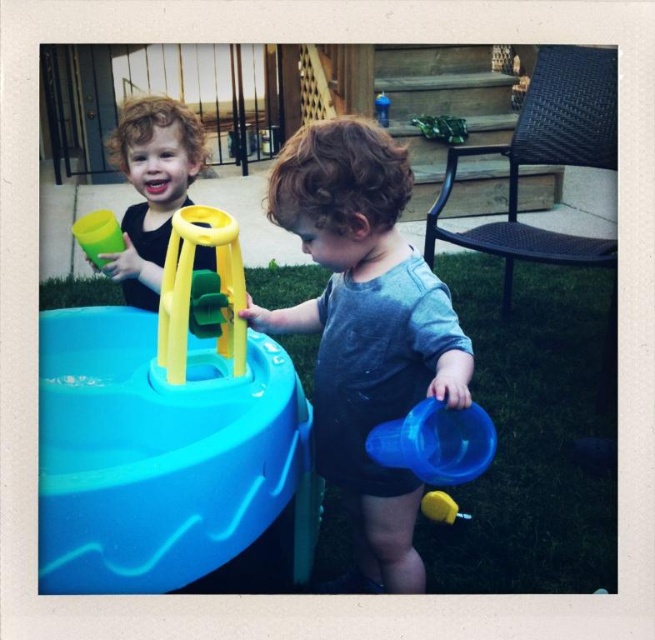
Is point (128, 387) positioned before point (181, 353)?

No, (128, 387) is behind (181, 353).

Who is higher up, matte plastic water table at center or yellow plastic stool at center?

yellow plastic stool at center is higher up.

The width and height of the screenshot is (655, 640). Identify the location of matte plastic water table at center. (168, 429).

What are the coordinates of `matte plastic water table at center` in the screenshot? It's located at (168, 429).

The image size is (655, 640). What do you see at coordinates (365, 326) in the screenshot? I see `gray matte shirt at center` at bounding box center [365, 326].

Which is more to the right, gray matte shirt at center or matte yellow cup at left?

Positioned to the right is gray matte shirt at center.

The image size is (655, 640). What do you see at coordinates (365, 326) in the screenshot? I see `gray matte shirt at center` at bounding box center [365, 326].

The width and height of the screenshot is (655, 640). In order to click on gray matte shirt at center in this screenshot , I will do click(x=365, y=326).

Between gray matte shirt at center and blue plastic cup at lower center, which one is positioned higher?

Positioned higher is gray matte shirt at center.

Is gray matte shirt at center to the right of blue plastic cup at lower center from the viewer's perspective?

No, gray matte shirt at center is not to the right of blue plastic cup at lower center.

Who is more distant from viewer, (398, 273) or (434, 474)?

Point (398, 273)

Locate an element on the screen. Image resolution: width=655 pixels, height=640 pixels. gray matte shirt at center is located at coordinates (365, 326).